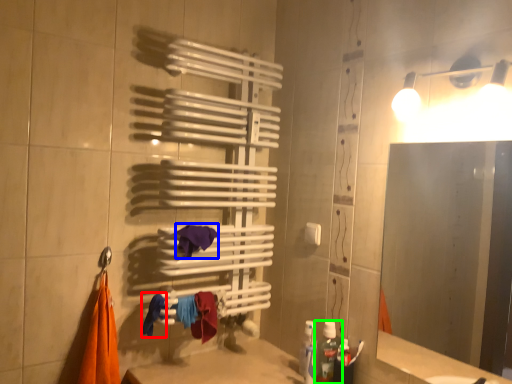
Question: Which is farther away from clothe (highlighted by a red box)? beach towel (highlighted by a blue box) or bottle (highlighted by a green box)?

Choices:
 (A) beach towel
 (B) bottle

Answer: (B)